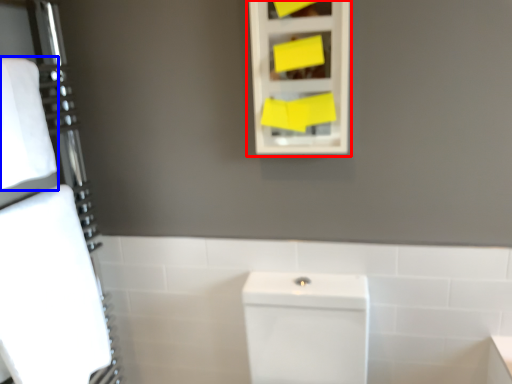
Question: Which object appears closest to the camera in this image, medicine cabinet (highlighted by a red box) or bath towel (highlighted by a blue box)?

Choices:
 (A) medicine cabinet
 (B) bath towel

Answer: (B)